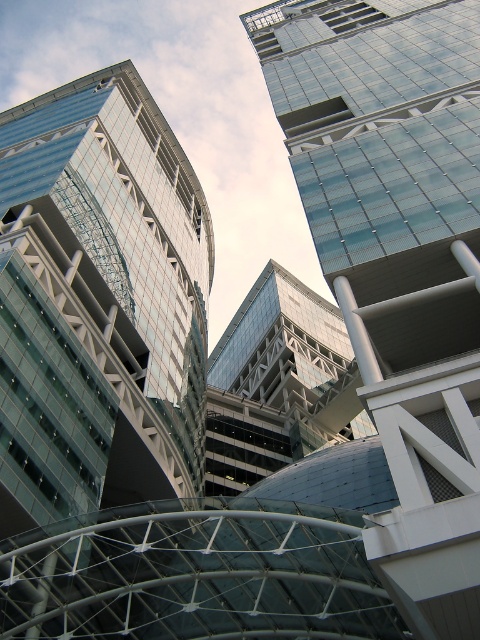
Question: Does transparent glass skyscraper at upper center have a larger size compared to transparent glass building at upper left?

Choices:
 (A) no
 (B) yes

Answer: (B)

Question: Which point is farther to the camera?

Choices:
 (A) (104, 346)
 (B) (442, 179)
 (C) (316, 374)

Answer: (C)

Question: In this image, where is transparent glass skyscraper at upper center located relative to glassy steel building at center?

Choices:
 (A) below
 (B) above

Answer: (B)

Question: Which object is closer to the camera taking this photo?

Choices:
 (A) transparent glass building at upper left
 (B) glassy steel building at center
 (C) transparent glass skyscraper at upper center

Answer: (C)

Question: Is transparent glass skyscraper at upper center above transparent glass building at upper left?

Choices:
 (A) no
 (B) yes

Answer: (B)

Question: Which object is positioned farthest from the transparent glass skyscraper at upper center?

Choices:
 (A) glassy steel building at center
 (B) transparent glass building at upper left

Answer: (A)